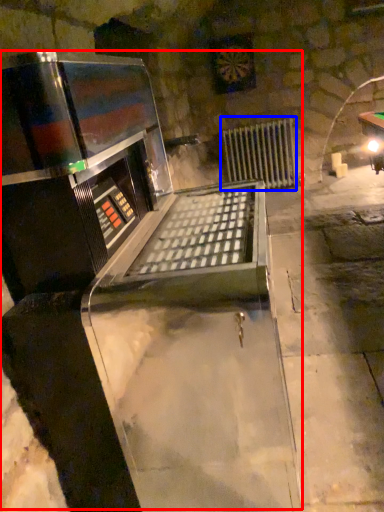
Question: Which object is closer to the camera taking this photo, wine cellar (highlighted by a red box) or radiator (highlighted by a blue box)?

Choices:
 (A) wine cellar
 (B) radiator

Answer: (A)